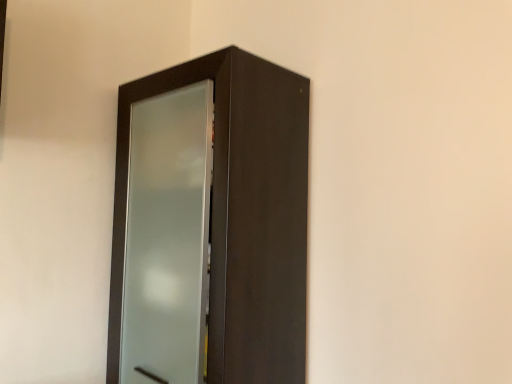
Question: Should I look upward or downward to see satin wood door at center?

Choices:
 (A) down
 (B) up

Answer: (A)